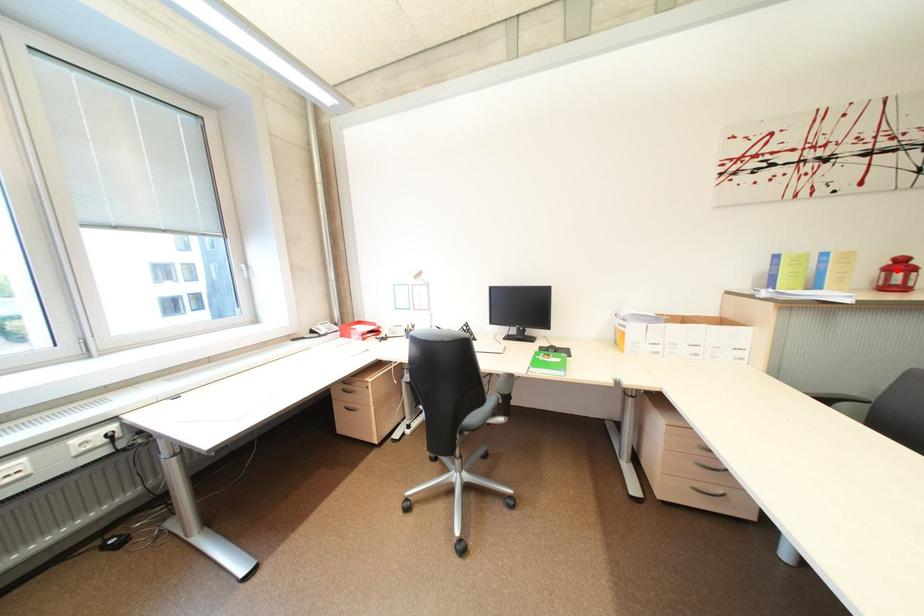
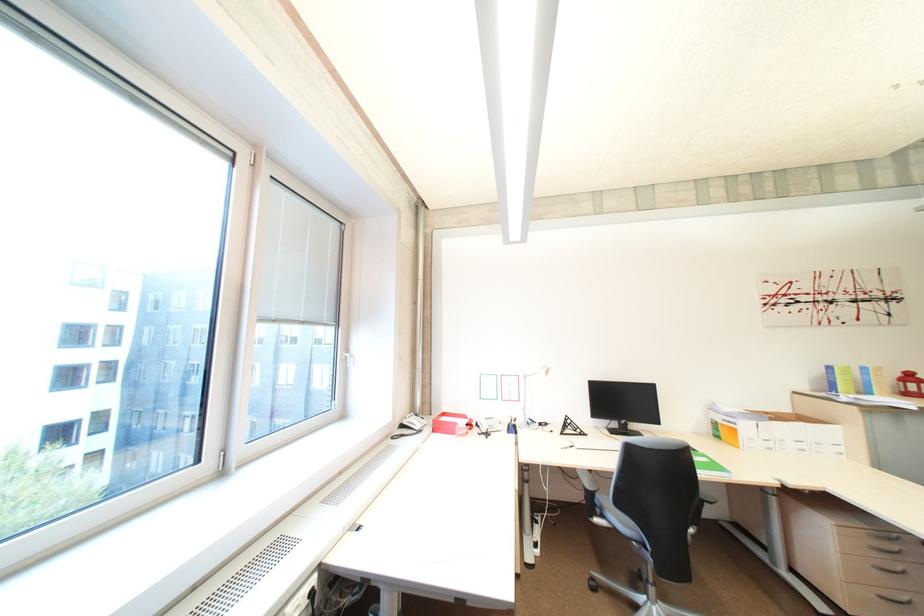
Where in the second image is the point corresponding to the highlighted location from the first image?

(913, 382)